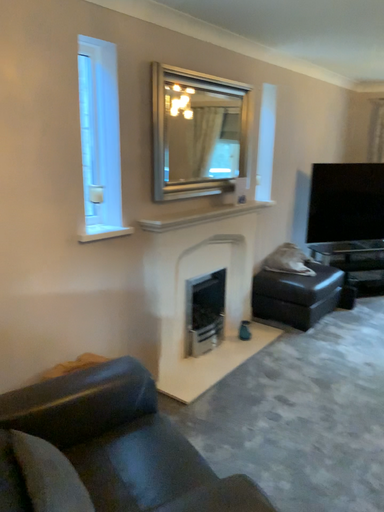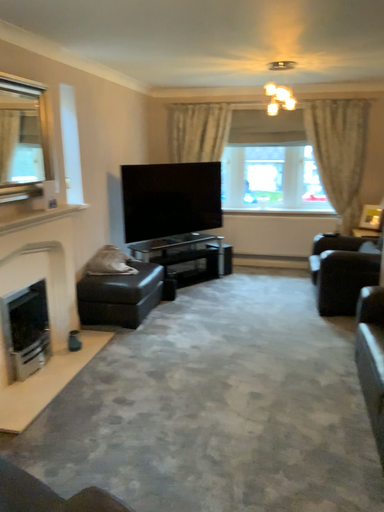
Question: How did the camera likely rotate when shooting the video?

Choices:
 (A) rotated right
 (B) rotated left

Answer: (A)